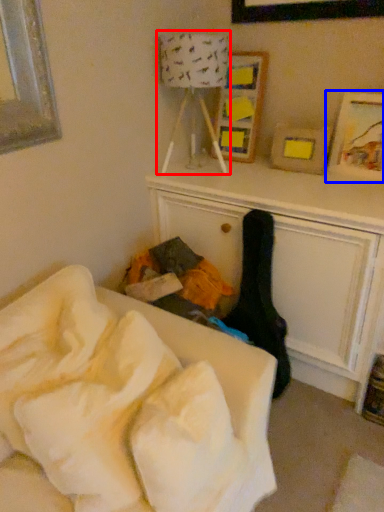
Question: Among these objects, which one is nearest to the camera, lamp (highlighted by a red box) or picture frame (highlighted by a blue box)?

Choices:
 (A) lamp
 (B) picture frame

Answer: (A)